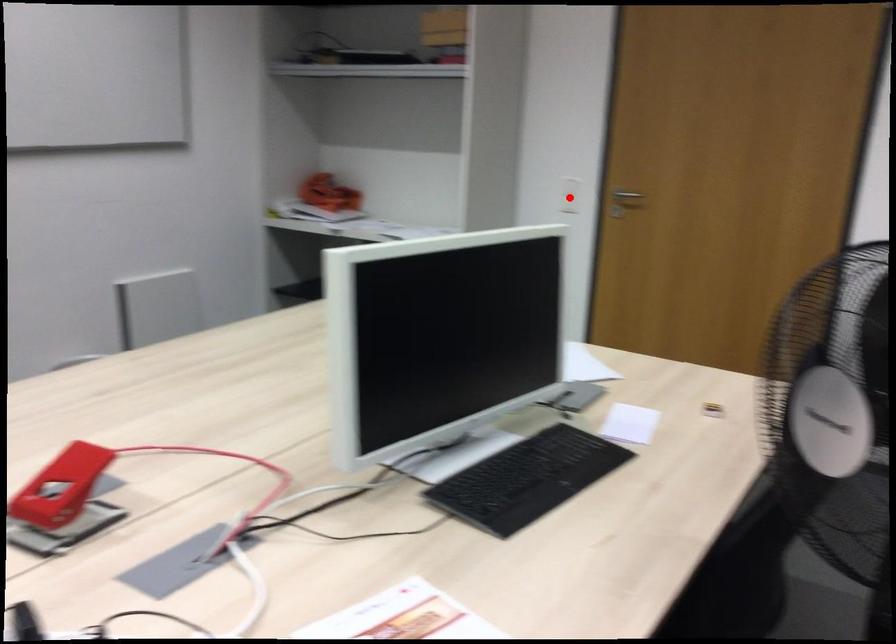
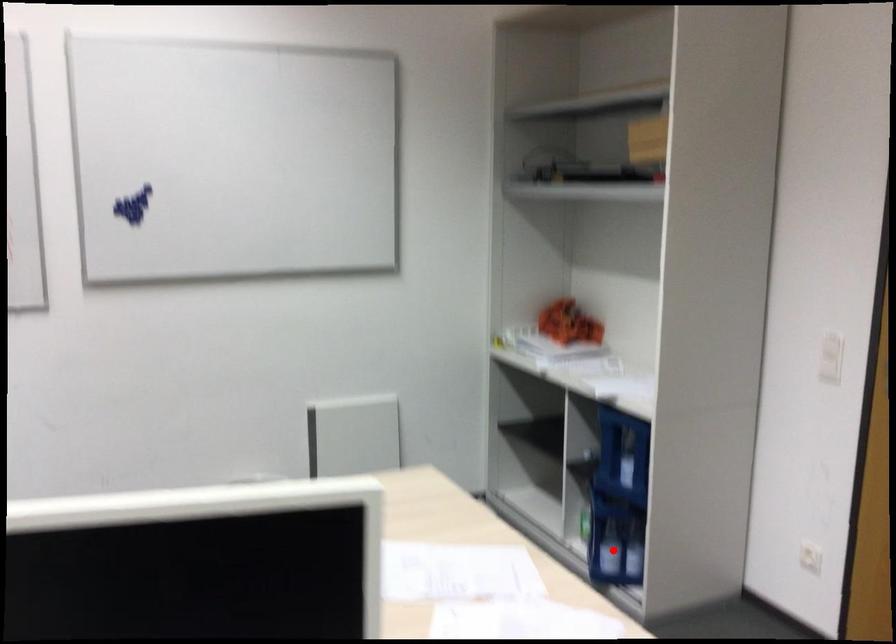
I am providing you with two images of the same scene from different viewpoints. A red point is marked on the first image and another point is marked on the second image. Is the red point in image1 aligned with the point shown in image2?

No